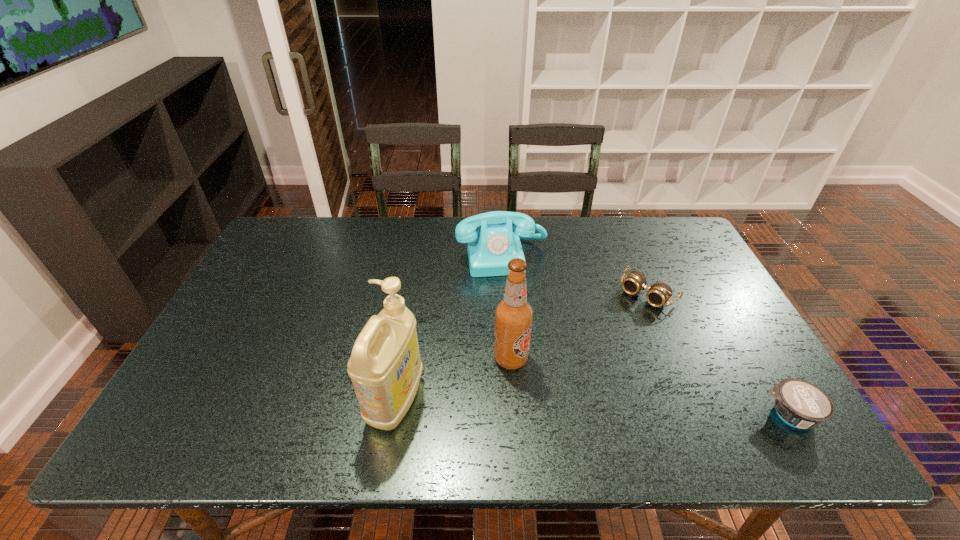
In order to click on goggles situated at the right edge in this screenshot , I will do `click(659, 294)`.

The width and height of the screenshot is (960, 540). Identify the location of object present at the near right corner. (801, 404).

Image resolution: width=960 pixels, height=540 pixels. In the image, there is a desktop. In order to click on vacant space at the far edge in this screenshot , I will do `click(370, 230)`.

The height and width of the screenshot is (540, 960). In the image, there is a desktop. Identify the location of blank space at the near edge. (348, 395).

In the image, there is a desktop. Where is `vacant region at the right edge`? vacant region at the right edge is located at coordinates (671, 279).

In the image, there is a desktop. What are the coordinates of `vacant space at the far left corner` in the screenshot? It's located at (324, 225).

You are a GUI agent. You are given a task and a screenshot of the screen. Output one action in this format:
    pyautogui.click(x=<x>, y=<y>)
    Task: Click on the free spot at the far right corner of the desktop
    
    Given the screenshot: What is the action you would take?
    pyautogui.click(x=673, y=256)

Locate an element on the screen. Image resolution: width=960 pixels, height=540 pixels. empty space that is in between the detergent and the beer bottle is located at coordinates (453, 380).

This screenshot has height=540, width=960. In order to click on unoccupied position between the detergent and the rightmost object in this screenshot , I will do `click(592, 408)`.

The width and height of the screenshot is (960, 540). Identify the location of unoccupied area between the telephone and the second object from right to left. (575, 275).